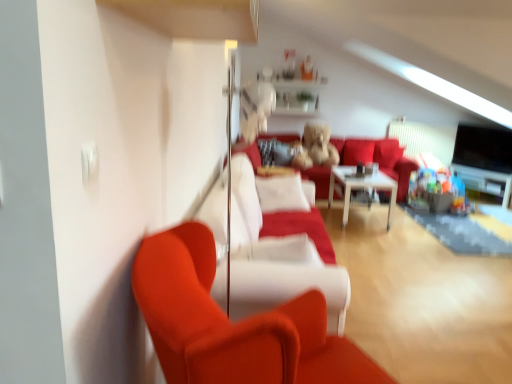
Question: From a real-world perspective, is white glossy shelf at upper center physically below white glossy table at center?

Choices:
 (A) yes
 (B) no

Answer: (B)

Question: Does white glossy shelf at upper center touch white glossy table at center?

Choices:
 (A) no
 (B) yes

Answer: (A)

Question: Can you confirm if white glossy shelf at upper center is positioned to the right of white glossy table at center?

Choices:
 (A) yes
 (B) no

Answer: (B)

Question: Considering the relative sizes of white glossy shelf at upper center and white glossy table at center in the image provided, is white glossy shelf at upper center taller than white glossy table at center?

Choices:
 (A) yes
 (B) no

Answer: (B)

Question: Is the position of white glossy shelf at upper center less distant than that of white glossy table at center?

Choices:
 (A) yes
 (B) no

Answer: (B)

Question: Does white glossy shelf at upper center have a lesser width compared to white glossy table at center?

Choices:
 (A) no
 (B) yes

Answer: (B)

Question: Is white glossy shelf at upper center not close to velvet red couch at center, the first couch viewed from the front?

Choices:
 (A) yes
 (B) no

Answer: (A)

Question: Can we say white glossy shelf at upper center lies outside velvet red couch at center, the second couch viewed from the back?

Choices:
 (A) yes
 (B) no

Answer: (A)

Question: Is white glossy shelf at upper center wider than velvet red couch at center, the first couch viewed from the front?

Choices:
 (A) yes
 (B) no

Answer: (B)

Question: Is white glossy shelf at upper center at the left side of velvet red couch at center, the second couch viewed from the back?

Choices:
 (A) no
 (B) yes

Answer: (A)

Question: Are white glossy shelf at upper center and velvet red couch at center, the second couch viewed from the back, beside each other?

Choices:
 (A) no
 (B) yes

Answer: (A)

Question: Considering the relative sizes of white glossy shelf at upper center and velvet red couch at center, the second couch viewed from the back, in the image provided, is white glossy shelf at upper center shorter than velvet red couch at center, the second couch viewed from the back,?

Choices:
 (A) no
 (B) yes

Answer: (B)

Question: Considering the relative sizes of matte red couch at left and velvet red couch at center, the second couch viewed from the back, in the image provided, is matte red couch at left wider than velvet red couch at center, the second couch viewed from the back,?

Choices:
 (A) no
 (B) yes

Answer: (A)